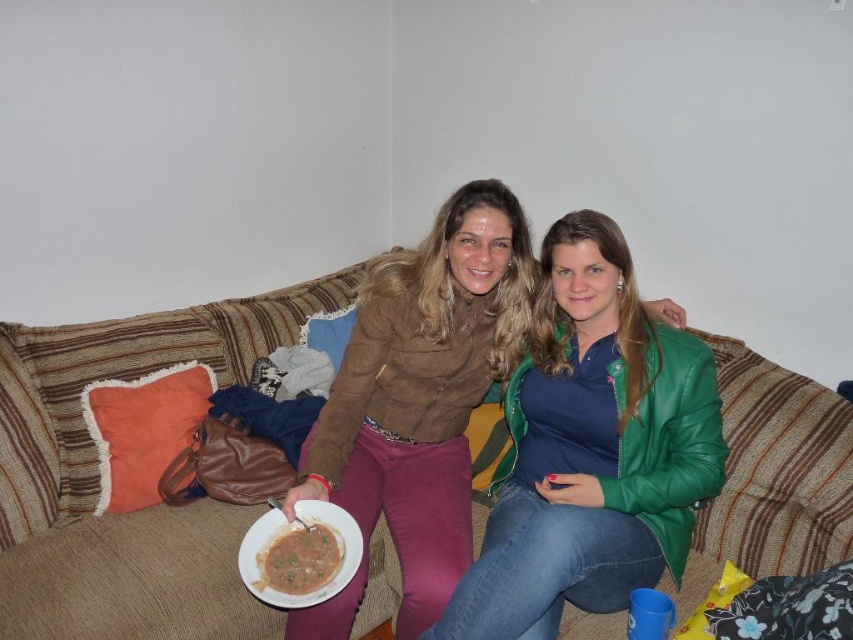
Question: Is brown fabric couch at center wider than white matte bowl at center?

Choices:
 (A) no
 (B) yes

Answer: (B)

Question: Based on their relative distances, which object is nearer to the white matte bowl at center?

Choices:
 (A) green leather jacket at center
 (B) brown matte bowl at center

Answer: (B)

Question: Where is brown fabric couch at center located in relation to green leather jacket at center in the image?

Choices:
 (A) right
 (B) left

Answer: (B)

Question: Which object is closer to the camera taking this photo?

Choices:
 (A) green leather jacket at center
 (B) white matte bowl at center
 (C) brown matte bowl at center

Answer: (A)

Question: Among these points, which one is nearest to the camera?

Choices:
 (A) (682, 490)
 (B) (83, 426)
 (C) (323, 529)
 (D) (305, 582)

Answer: (D)

Question: Is green leather jacket at center positioned in front of brown matte bowl at center?

Choices:
 (A) no
 (B) yes

Answer: (B)